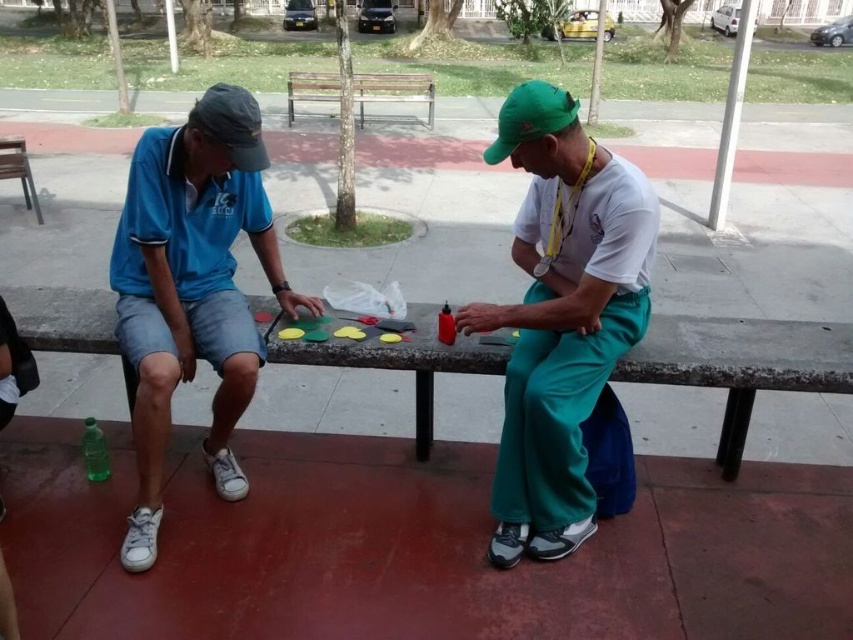
Question: Is matte black baseball cap at left wider than wooden bench at center?

Choices:
 (A) yes
 (B) no

Answer: (B)

Question: Which point appears farthest from the camera in this image?

Choices:
 (A) (10, 177)
 (B) (363, 128)

Answer: (B)

Question: Where is matte black baseball cap at left located in relation to wooden bench at center in the image?

Choices:
 (A) left
 (B) right

Answer: (B)

Question: Can you confirm if blue cotton shirt at left is smaller than green fabric baseball cap at upper right?

Choices:
 (A) yes
 (B) no

Answer: (A)

Question: Which point is farther from the camera taking this photo?

Choices:
 (A) (733, 472)
 (B) (238, 131)

Answer: (A)

Question: Among these points, which one is nearest to the camera?

Choices:
 (A) (256, 164)
 (B) (514, 120)

Answer: (B)